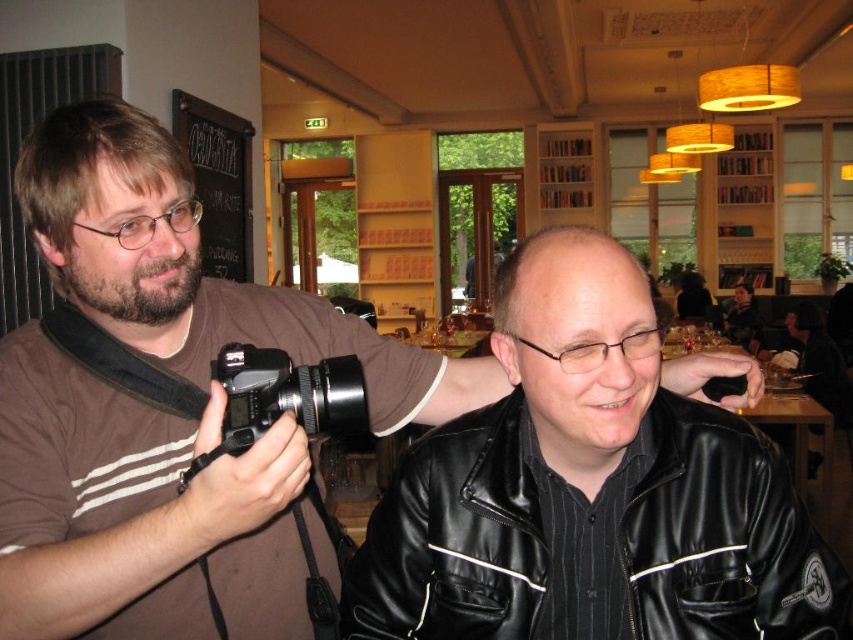
Is black leather jacket at lower right thinner than black plastic camera at center?

No.

Does black leather jacket at lower right have a greater width compared to black plastic camera at center?

Yes.

Locate an element on the screen. black leather jacket at lower right is located at coordinates (724, 536).

Describe the element at coordinates (724, 536) in the screenshot. I see `black leather jacket at lower right` at that location.

Is black leather jacket at lower right further to camera compared to black leather jacket at center?

No, black leather jacket at lower right is in front of black leather jacket at center.

Where is `black leather jacket at lower right`? black leather jacket at lower right is located at coordinates (724, 536).

From the picture: Is black plastic camera at center thinner than black leather jacket at center?

Correct, black plastic camera at center's width is less than black leather jacket at center's.

The width and height of the screenshot is (853, 640). What do you see at coordinates (286, 396) in the screenshot?
I see `black plastic camera at center` at bounding box center [286, 396].

I want to click on black plastic camera at center, so click(x=286, y=396).